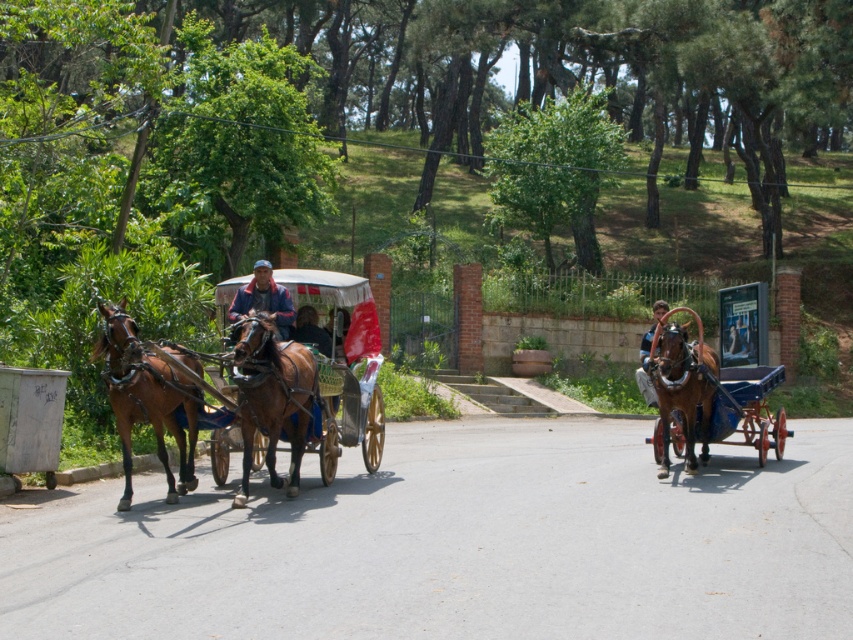
Between blue denim jacket at center and dark brown leather jacket at center, which one has more height?

Standing taller between the two is blue denim jacket at center.

Can you confirm if blue denim jacket at center is positioned to the left of dark brown leather jacket at center?

Yes, blue denim jacket at center is to the left of dark brown leather jacket at center.

Image resolution: width=853 pixels, height=640 pixels. Identify the location of blue denim jacket at center. (264, 300).

Where is `blue denim jacket at center`? blue denim jacket at center is located at coordinates pyautogui.click(x=264, y=300).

Can you confirm if brown glossy horse at left is smaller than blue denim jacket at center?

No.

Locate an element on the screen. This screenshot has height=640, width=853. brown glossy horse at left is located at coordinates (146, 397).

Describe the element at coordinates (146, 397) in the screenshot. I see `brown glossy horse at left` at that location.

You are a GUI agent. You are given a task and a screenshot of the screen. Output one action in this format:
    pyautogui.click(x=<x>, y=<y>)
    Task: Click on the brown glossy horse at left
    This screenshot has width=853, height=640.
    Given the screenshot: What is the action you would take?
    pyautogui.click(x=146, y=397)

Does brown glossy horse at left appear over brown glossy horse at center?

No.

Which is behind, point (172, 372) or point (289, 349)?

The point (172, 372) is behind.

Is point (194, 412) farther from camera compared to point (276, 413)?

Yes, point (194, 412) is farther from viewer.

The image size is (853, 640). What are the coordinates of `brown glossy horse at left` in the screenshot? It's located at (146, 397).